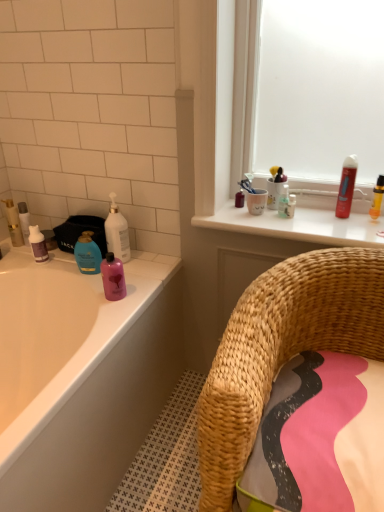
The image size is (384, 512). What are the coordinates of `vacant area that lies to the right of translucent plastic toothbrush holder at upper center, the 5th toiletry when ordered from left to right` in the screenshot? It's located at coord(327,218).